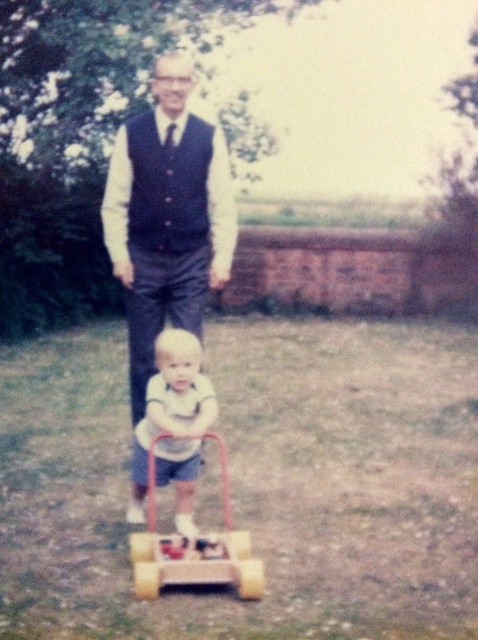
You are a photographer trying to capture a photo of the dark blue fabric vest at center and the yellow rubber toy at center. Which object should you focus on first to ensure both are in clear focus?

You should focus on the dark blue fabric vest at center first because it is closer to you than the yellow rubber toy at center, so adjusting focus from near to far will help both be in clear focus.

You are a fashion designer observing an adult wearing a dark blue textured vest at center and a smooth white shirt at center. Which clothing item would you recommend to a client who prefers a more voluminous style?

The dark blue textured vest at center is bigger than the smooth white shirt at center, so it would be the better choice for someone seeking a more voluminous style.